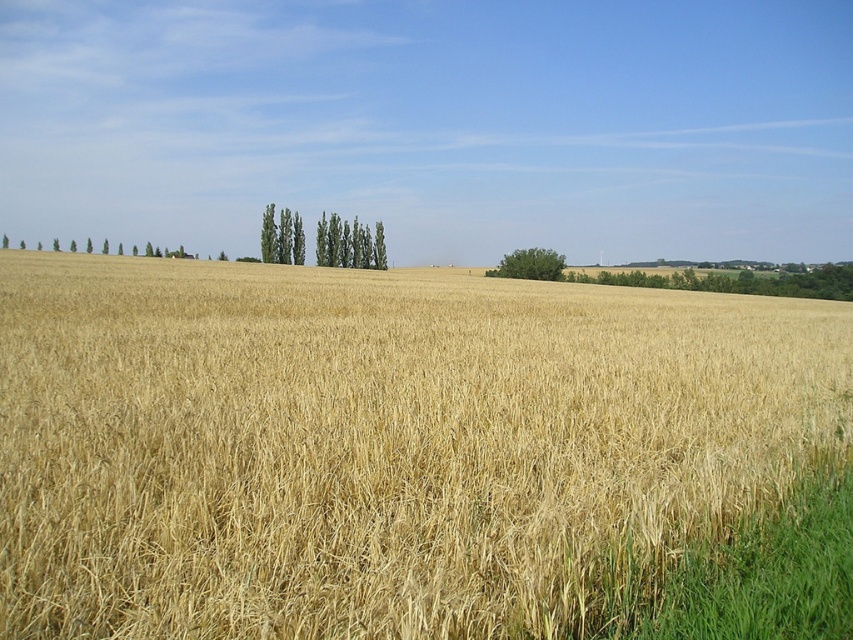
Question: Which is nearer to the green leafy tree at center?

Choices:
 (A) golden dry grass at center
 (B) green leafy trees at center

Answer: (B)

Question: Which point is farther to the camera?

Choices:
 (A) green leafy tree at center
 (B) green leafy trees at center
 (C) golden dry grass at center

Answer: (B)

Question: Does green leafy trees at center lie behind green leafy tree at center?

Choices:
 (A) yes
 (B) no

Answer: (A)

Question: Is golden dry grass at center to the right of green leafy tree at center from the viewer's perspective?

Choices:
 (A) no
 (B) yes

Answer: (A)

Question: Considering the real-world distances, which object is closest to the golden dry grass at center?

Choices:
 (A) green leafy trees at center
 (B) green leafy tree at center

Answer: (B)

Question: Does golden dry grass at center have a smaller size compared to green leafy trees at center?

Choices:
 (A) no
 (B) yes

Answer: (A)